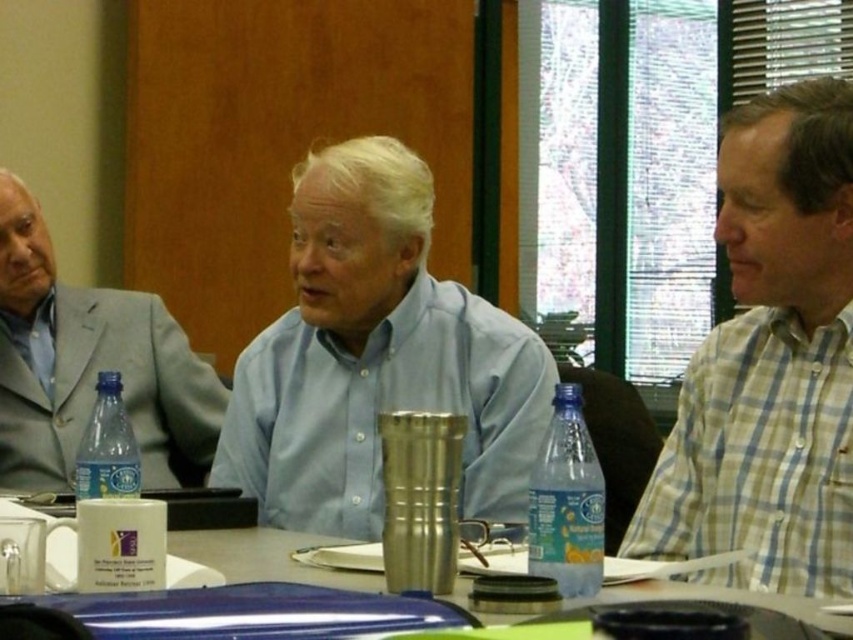
You are attending a meeting and need to reach for the blue plastic bottle at lower left without disturbing the matte blue shirt at center. Can you safely do so?

The matte blue shirt at center is above the blue plastic bottle at lower left, so you can safely reach for the blue plastic bottle at lower left without disturbing the matte blue shirt at center.

From the picture: You are organizing a meeting and need to place a new item between the gray suit jacket at left and the blue plastic bottle at lower left. Where should you place it to ensure it is between them?

Place the new item between the gray suit jacket at left and the blue plastic bottle at lower left, as the gray suit jacket at left is on the left side of the blue plastic bottle at lower left.